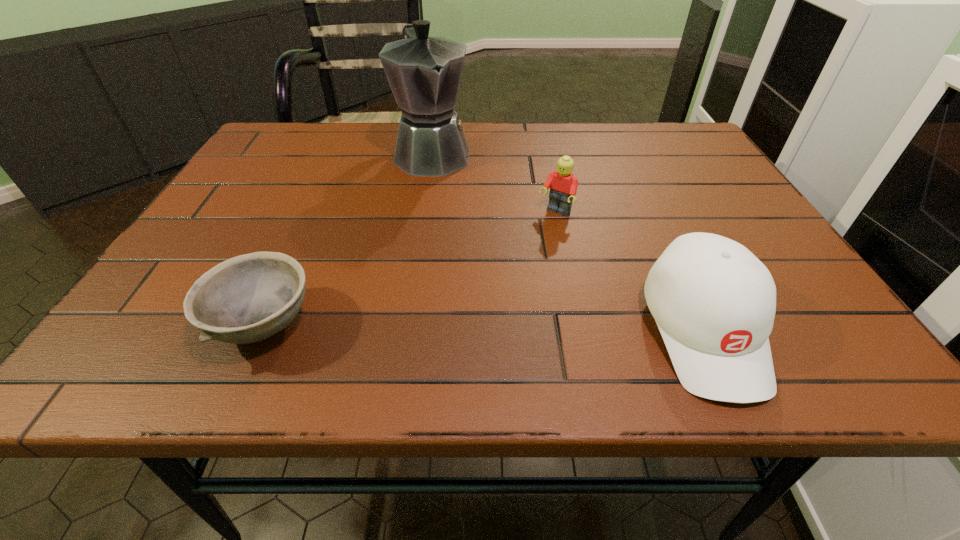
Image resolution: width=960 pixels, height=540 pixels. Identify the location of object that is at the near right corner. (714, 302).

Where is `free space at the far edge of the desktop`? free space at the far edge of the desktop is located at coordinates (523, 157).

At what (x,y) coordinates should I click in order to perform the action: click on free region at the near edge of the desktop. Please return your answer as a coordinate pair (x, y). This screenshot has height=540, width=960. Looking at the image, I should click on (481, 292).

Where is `blank space at the left edge of the desktop`? blank space at the left edge of the desktop is located at coordinates (205, 234).

You are a GUI agent. You are given a task and a screenshot of the screen. Output one action in this format:
    pyautogui.click(x=<x>, y=<y>)
    Task: Click on the free location at the right edge of the desktop
    
    Given the screenshot: What is the action you would take?
    pyautogui.click(x=753, y=245)

The image size is (960, 540). In the image, there is a desktop. What are the coordinates of `free region at the far left corner` in the screenshot? It's located at (312, 139).

Find the location of `free space at the far right corner of the desktop`. free space at the far right corner of the desktop is located at coordinates (655, 128).

Find the location of a particular element. The height and width of the screenshot is (540, 960). empty space between the third object from left to right and the coffeepot is located at coordinates (494, 183).

At what (x,y) coordinates should I click in order to perform the action: click on vacant region between the leftmost object and the coffeepot. Please return your answer as a coordinate pair (x, y). Looking at the image, I should click on (348, 239).

Image resolution: width=960 pixels, height=540 pixels. Find the location of `vacant space that's between the leftmost object and the baseball cap`. vacant space that's between the leftmost object and the baseball cap is located at coordinates (484, 328).